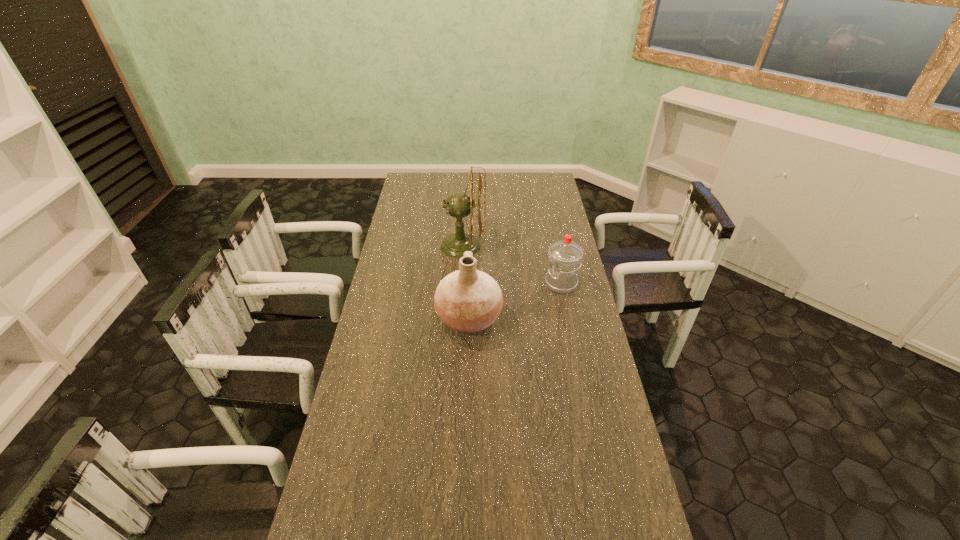
I want to click on fan, so click(458, 205).

Find the location of a particular element. This screenshot has height=540, width=960. the tallest object is located at coordinates (458, 205).

What are the coordinates of `the nearest object` in the screenshot? It's located at (468, 300).

This screenshot has height=540, width=960. Find the location of `the second farthest object`. the second farthest object is located at coordinates (565, 256).

This screenshot has width=960, height=540. I want to click on water bottle, so click(565, 256).

You are a GUI agent. You are given a task and a screenshot of the screen. Output one action in this format:
    pyautogui.click(x=<x>, y=<y>)
    Task: Click on the free region located in front of the tallest object, directing air flow
    This screenshot has height=540, width=960.
    Given the screenshot: What is the action you would take?
    pyautogui.click(x=511, y=246)

The width and height of the screenshot is (960, 540). Find the location of `vacant region located to pour from the handle of the nearest object`. vacant region located to pour from the handle of the nearest object is located at coordinates (575, 319).

Locate an element on the screen. free space located 0.330m on the handle side of the shortest object is located at coordinates (460, 284).

The width and height of the screenshot is (960, 540). In order to click on free region located 0.360m on the handle side of the shortest object in this screenshot , I will do tap(452, 284).

You are a GUI agent. You are given a task and a screenshot of the screen. Output one action in this format:
    pyautogui.click(x=<x>, y=<y>)
    Task: Click on the vacant space located 0.320m on the handle side of the shortest object
    The height and width of the screenshot is (540, 960).
    Given the screenshot: What is the action you would take?
    pyautogui.click(x=463, y=284)